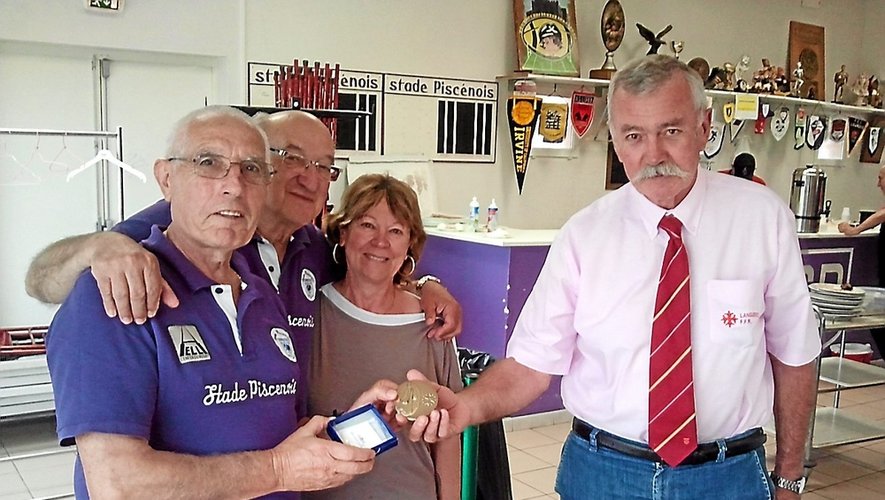
Image resolution: width=885 pixels, height=500 pixels. Identify the location of trophies. 703,71, 724,72, 744,79, 760,78, 789,78, 843,87, 873,92, 857,92.